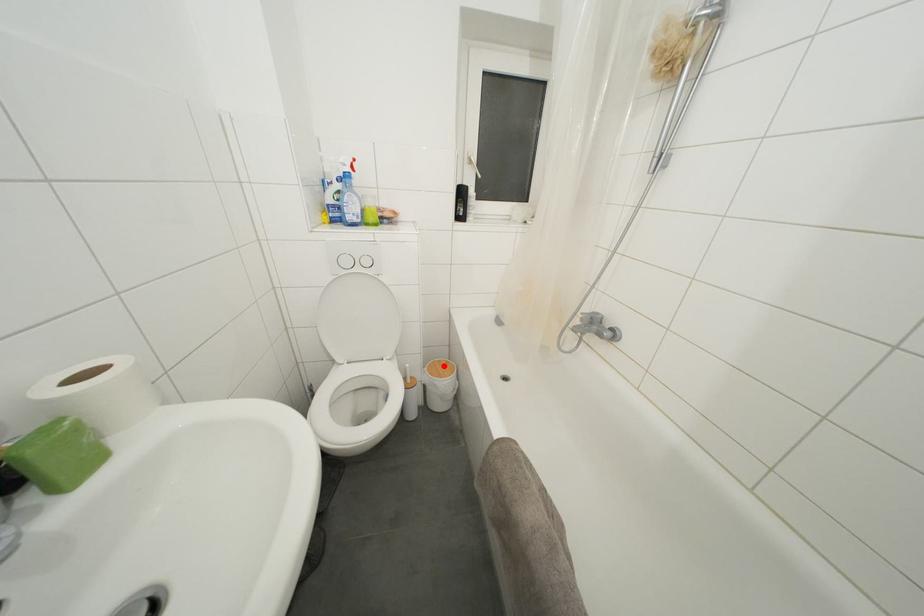
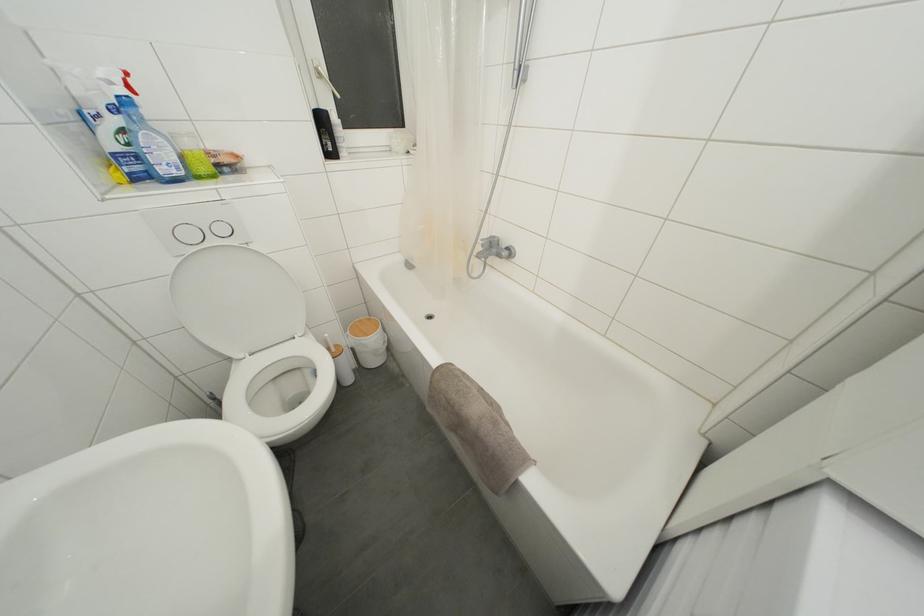
In the second image, find the point that corresponds to the highlighted location in the first image.

(363, 326)